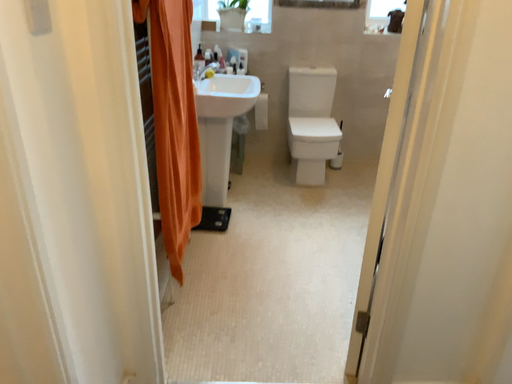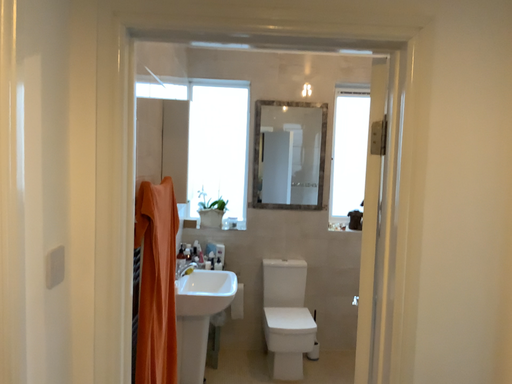
Question: Which way did the camera rotate in the video?

Choices:
 (A) rotated downward
 (B) rotated upward

Answer: (B)